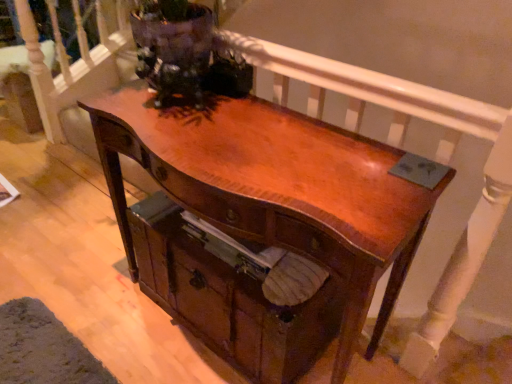
Question: Would you say wooden drawer at center is inside or outside shiny brown wood desk at center?

Choices:
 (A) inside
 (B) outside

Answer: (A)

Question: Based on their sizes in the image, would you say wooden drawer at center is bigger or smaller than shiny brown wood desk at center?

Choices:
 (A) big
 (B) small

Answer: (B)

Question: From a real-world perspective, is wooden drawer at center positioned above or below shiny brown wood desk at center?

Choices:
 (A) below
 (B) above

Answer: (A)

Question: From the image's perspective, is shiny brown wood desk at center positioned above or below wooden drawer at center?

Choices:
 (A) above
 (B) below

Answer: (A)

Question: Is shiny brown wood desk at center spatially inside wooden drawer at center, or outside of it?

Choices:
 (A) inside
 (B) outside

Answer: (A)

Question: In terms of width, does shiny brown wood desk at center look wider or thinner when compared to wooden drawer at center?

Choices:
 (A) wide
 (B) thin

Answer: (B)

Question: From a real-world perspective, relative to wooden drawer at center, is shiny brown wood desk at center vertically above or below?

Choices:
 (A) above
 (B) below

Answer: (A)